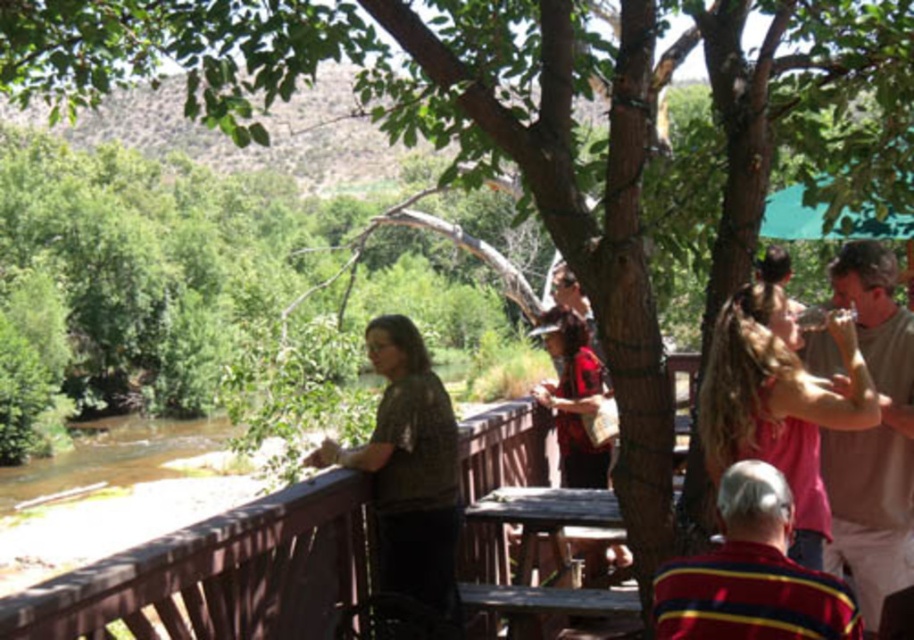
Question: Which point appears farthest from the camera in this image?

Choices:
 (A) (576, 611)
 (B) (731, 518)
 (C) (730, 314)

Answer: (A)

Question: Which is farther from the textured brown shirt at left?

Choices:
 (A) pink fabric shirt at right
 (B) wooden picnic table at center
 (C) striped cotton shirt at center
 (D) pink fabric shirt at upper right

Answer: (A)

Question: Is pink fabric shirt at upper right positioned behind textured brown shirt at left?

Choices:
 (A) yes
 (B) no

Answer: (B)

Question: Can you confirm if pink fabric shirt at upper right is bigger than textured brown shirt at left?

Choices:
 (A) yes
 (B) no

Answer: (A)

Question: Estimate the real-world distances between objects in this image. Which object is farther from the striped cotton shirt at center?

Choices:
 (A) pink fabric shirt at right
 (B) reddish-brown fabric bag at center
 (C) wooden picnic table at center
 (D) pink fabric shirt at upper right

Answer: (B)

Question: Can you confirm if pink fabric shirt at right is positioned below striped cotton shirt at center?

Choices:
 (A) yes
 (B) no

Answer: (B)